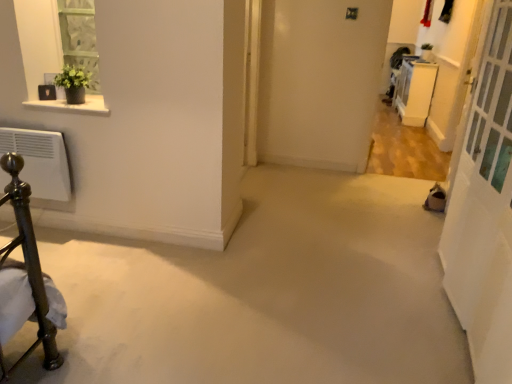
Identify the location of vacant space positioned to the left of white glass screen door at right. This screenshot has width=512, height=384. (329, 307).